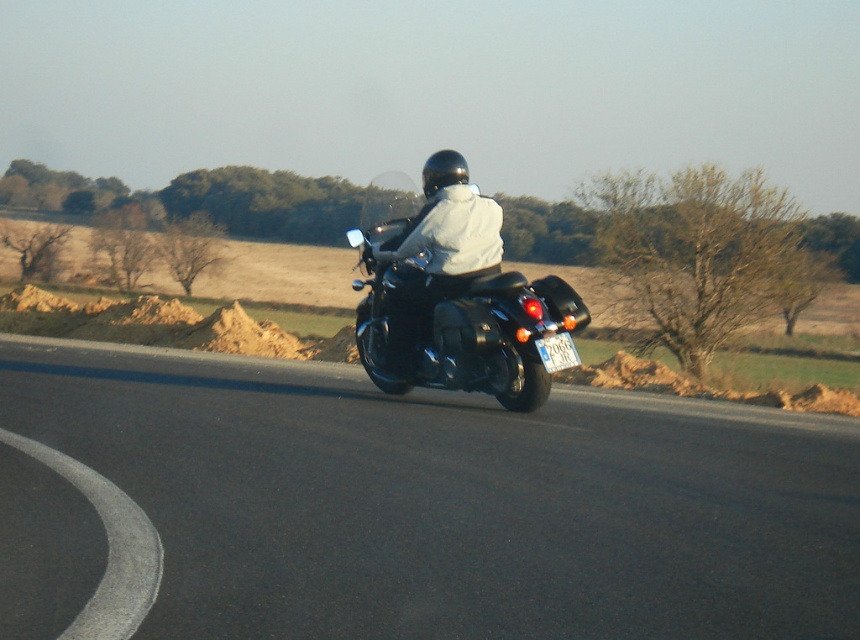
Question: Which point appears closest to the camera in this image?

Choices:
 (A) (268, 403)
 (B) (458, 276)

Answer: (B)

Question: Where is black asphalt curve at lower left located in relation to matte black motorcycle at center in the image?

Choices:
 (A) left
 (B) right

Answer: (A)

Question: Does black asphalt curve at lower left have a lesser width compared to matte black motorcycle at center?

Choices:
 (A) no
 (B) yes

Answer: (B)

Question: Based on their relative distances, which object is farther from the black matte motorcycle at center?

Choices:
 (A) matte black motorcycle at center
 (B) black asphalt road at center
 (C) black asphalt curve at lower left

Answer: (C)

Question: Based on their relative distances, which object is farther from the black asphalt road at center?

Choices:
 (A) matte black motorcycle at center
 (B) black matte motorcycle at center

Answer: (B)

Question: Is black matte motorcycle at center to the right of matte black motorcycle at center from the viewer's perspective?

Choices:
 (A) yes
 (B) no

Answer: (B)